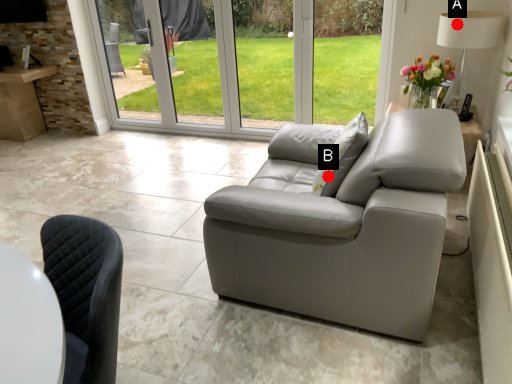
Question: Two points are circled on the image, labeled by A and B beside each circle. Which point appears closest to the camera in this image?

Choices:
 (A) A is closer
 (B) B is closer

Answer: (B)